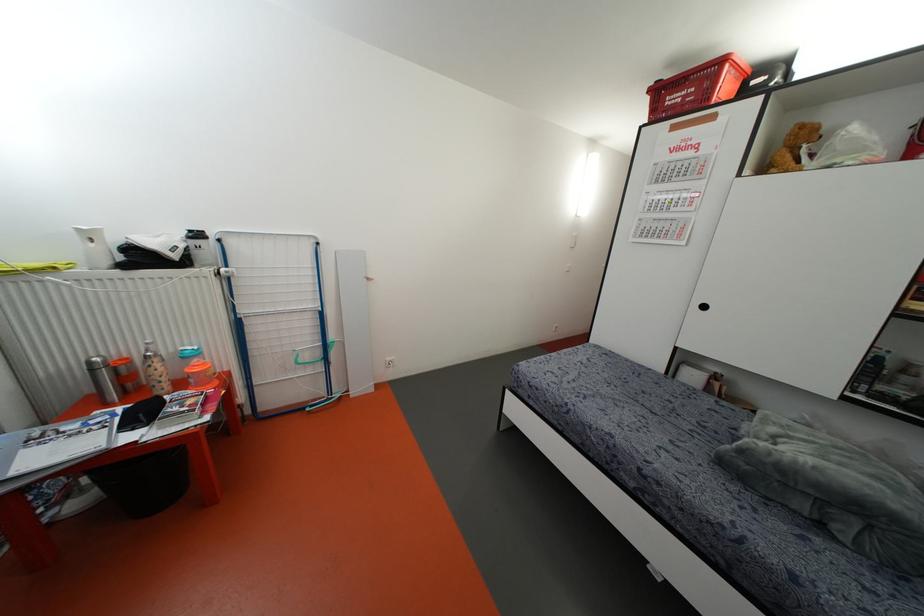
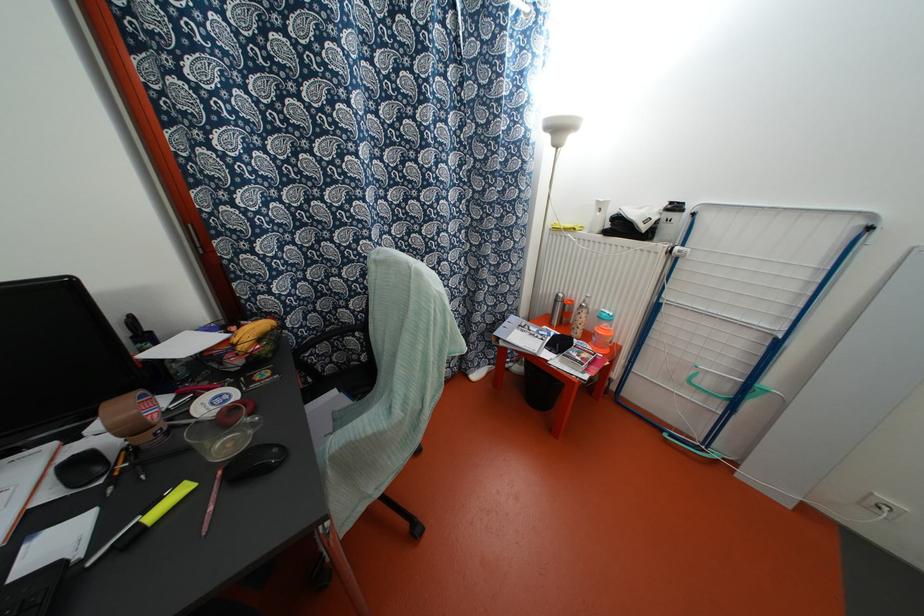
Find the pixel in the second image that matches point 91,370 in the first image.

(554, 301)